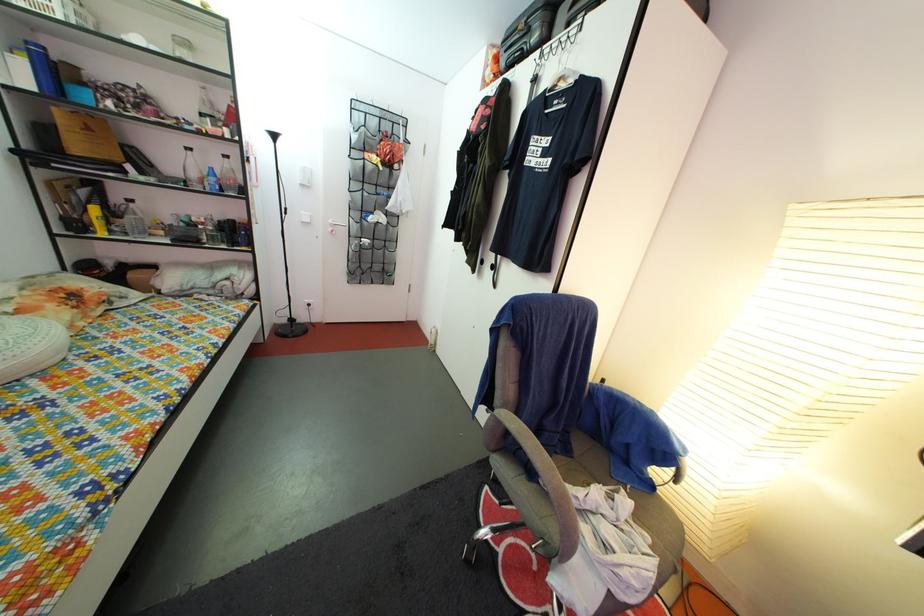
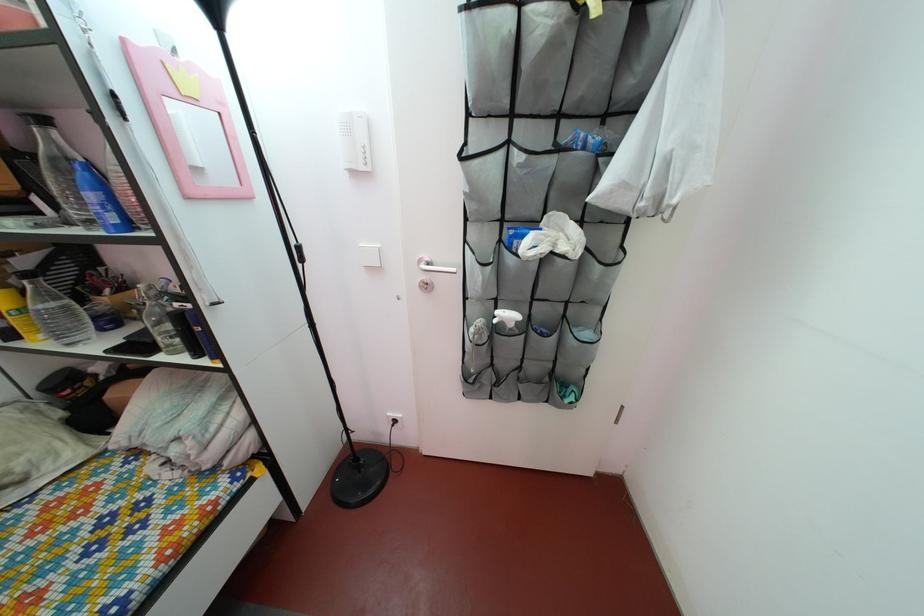
Locate, in the second image, the point that corresponds to [92,201] in the first image.

(32, 270)